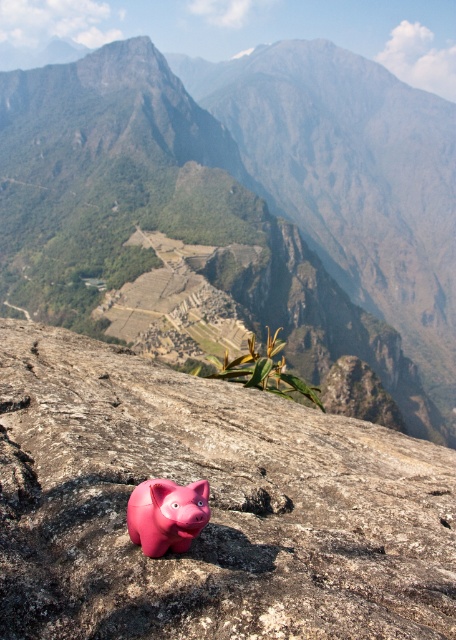
Question: Can you confirm if matte gray rock at center is positioned to the right of pink rubber piggy bank at center?

Choices:
 (A) yes
 (B) no

Answer: (A)

Question: Which object is positioned farthest from the pink rubber piggy bank at center?

Choices:
 (A) matte gray rock at center
 (B) pink matte piggy bank at center

Answer: (A)

Question: Can you confirm if pink matte piggy bank at center is smaller than pink rubber piggy bank at center?

Choices:
 (A) no
 (B) yes

Answer: (A)

Question: Which point is farther to the camera?

Choices:
 (A) (196, 493)
 (B) (362, 531)

Answer: (B)

Question: Which object appears closest to the camera in this image?

Choices:
 (A) pink matte piggy bank at center
 (B) pink rubber piggy bank at center

Answer: (A)

Question: Does pink matte piggy bank at center appear over pink rubber piggy bank at center?

Choices:
 (A) yes
 (B) no

Answer: (A)